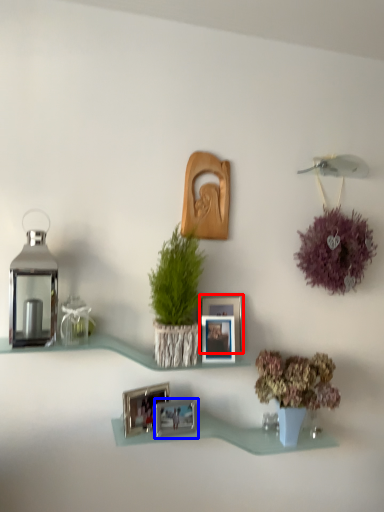
Question: Which point is closer to the camera, picture frame (highlighted by a red box) or picture frame (highlighted by a blue box)?

Choices:
 (A) picture frame
 (B) picture frame

Answer: (B)